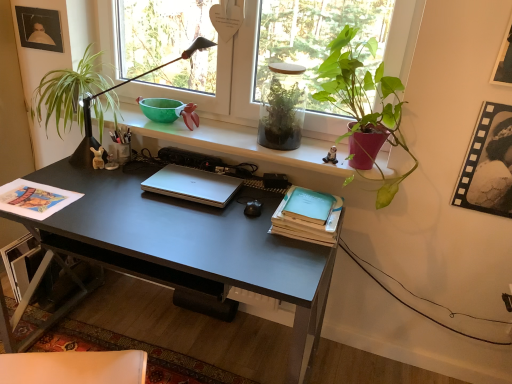
Question: In the image, is light blue matte paper at center right, arranged as the 1th paperback book when ordered from the bottom, positioned in front of or behind translucent glass terrarium at center, which is counted as the 2th houseplant, starting from the right?

Choices:
 (A) front
 (B) behind

Answer: (A)

Question: From a real-world perspective, is light blue matte paper at center right, arranged as the 1th paperback book when ordered from the bottom, above or below translucent glass terrarium at center, which ranks as the second houseplant in left-to-right order?

Choices:
 (A) below
 (B) above

Answer: (A)

Question: Which is nearer to the green matte plant at upper right, the 1th houseplant from the right?

Choices:
 (A) green leafy plant at left, the 1th houseplant positioned from the left
 (B) light blue matte paper at center right, arranged as the 1th paperback book when ordered from the bottom
 (C) matte black picture frame at upper left, placed as the 2th picture frame when sorted from front to back
 (D) silver metallic laptop at center
 (E) teal matte paperback book at right, the 2th paperback book ordered from the bottom

Answer: (B)

Question: Considering the real-world distances, which object is closest to the transparent glass window at upper center?

Choices:
 (A) light blue matte paper at center right, the second paperback book when ordered from top to bottom
 (B) matte black desk at center
 (C) black filmstrip at upper right, which appears as the second picture frame when viewed from the back
 (D) silver metallic laptop at center
 (E) matte black picture frame at upper left, the first picture frame from the top

Answer: (E)